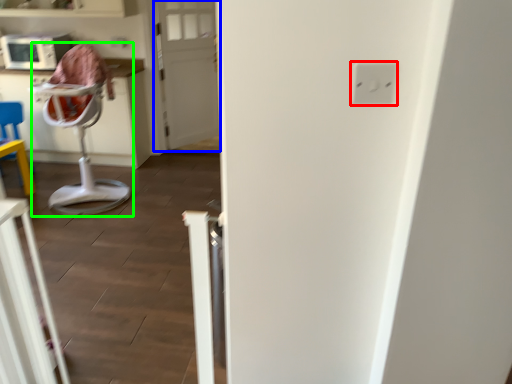
Question: Considering the real-world distances, which object is farthest from electric outlet (highlighted by a red box)? door (highlighted by a blue box) or feeding chair (highlighted by a green box)?

Choices:
 (A) door
 (B) feeding chair

Answer: (A)